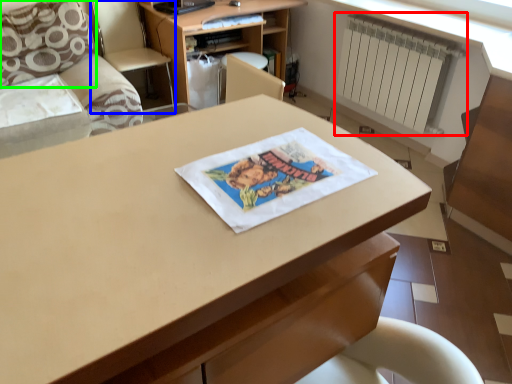
Question: Considering the real-world distances, which object is farthest from radiator (highlighted by a red box)? armchair (highlighted by a blue box) or pillow (highlighted by a green box)?

Choices:
 (A) armchair
 (B) pillow

Answer: (B)